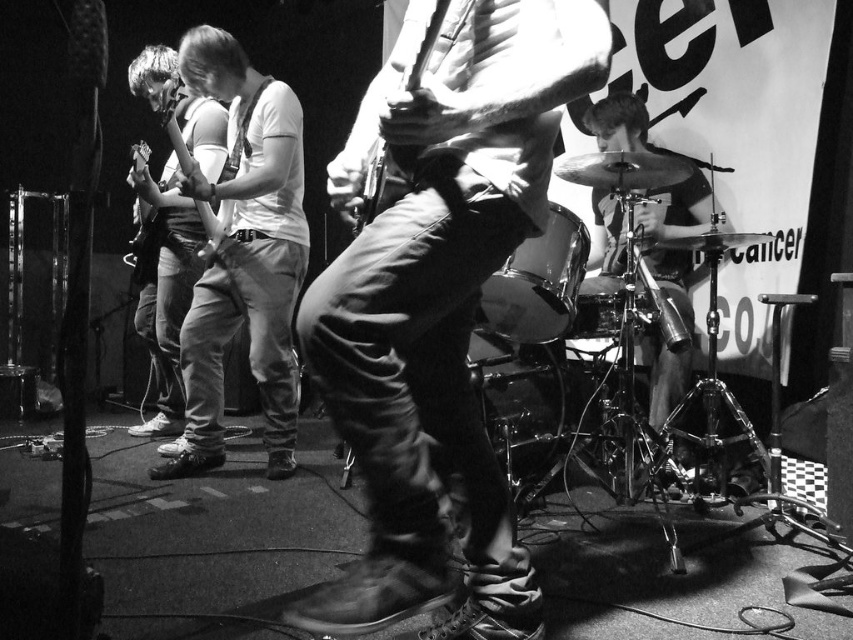
Who is lower down, leather boots at center or metallic silver guitar at center?

Positioned lower is leather boots at center.

Is point (467, 104) behind point (433, 32)?

Yes, point (467, 104) is farther from viewer.

This screenshot has height=640, width=853. I want to click on leather boots at center, so click(x=439, y=300).

Between denim pants at center and metallic silver guitar at center, which one appears on the left side from the viewer's perspective?

denim pants at center is more to the left.

The image size is (853, 640). Identify the location of denim pants at center. (165, 285).

Who is more forward, (229, 99) or (163, 70)?

Positioned in front is point (229, 99).

Who is positioned more to the left, matte white guitar at center or denim pants at center?

From the viewer's perspective, denim pants at center appears more on the left side.

Which is behind, point (206, 410) or point (138, 160)?

The point (138, 160) is more distant.

The width and height of the screenshot is (853, 640). In order to click on matte white guitar at center in this screenshot , I will do `click(242, 257)`.